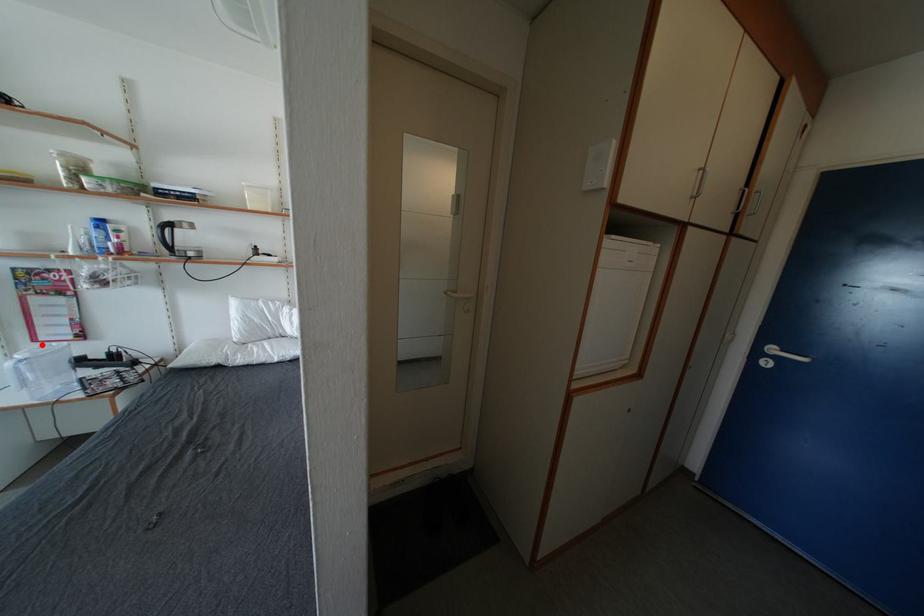
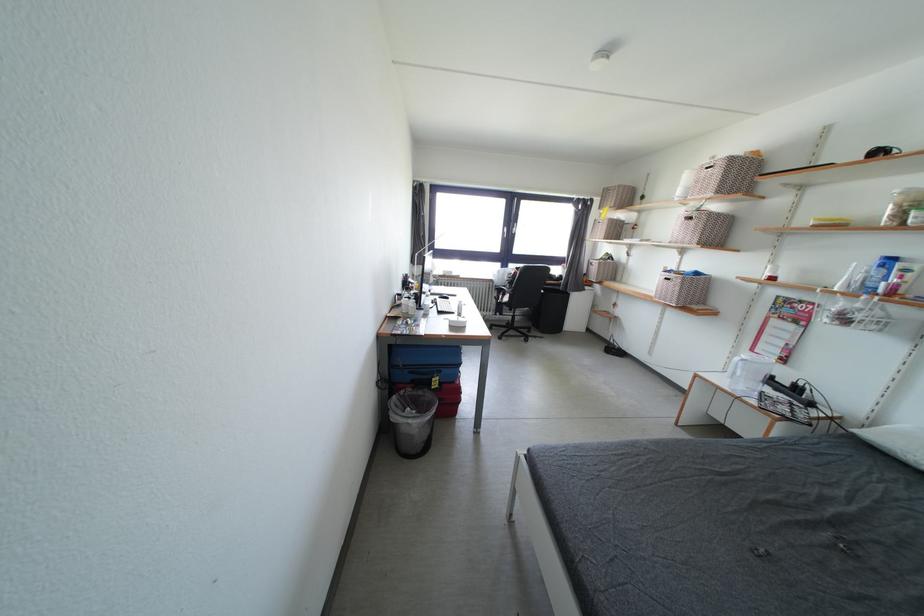
In the second image, find the point that corresponds to the highlighted location in the first image.

(759, 355)